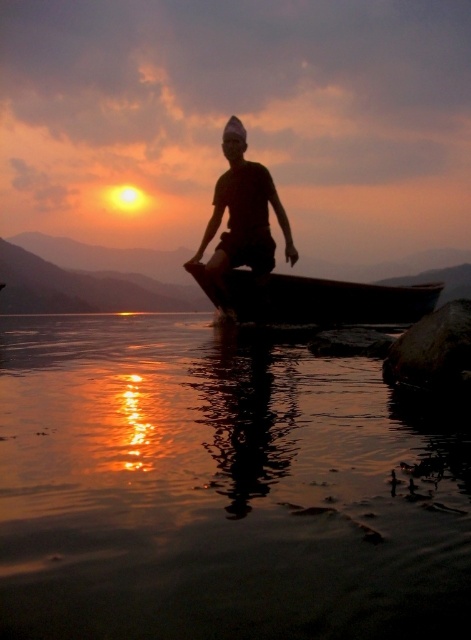
Is wooden canoe at center below matte black shirt at center?

Yes.

Does wooden canoe at center have a lesser width compared to matte black shirt at center?

Yes.

Who is more distant from viewer, (376, 298) or (268, 177)?

The point (376, 298) is more distant.

What are the coordinates of `wooden canoe at center` in the screenshot? It's located at (316, 298).

Can you confirm if transparent water at center is positioned above wooden canoe at center?

No, transparent water at center is not above wooden canoe at center.

The image size is (471, 640). I want to click on transparent water at center, so click(219, 490).

Measure the distance between transparent water at center and camera.

4.42 feet

I want to click on transparent water at center, so click(x=219, y=490).

Between transparent water at center and matte black shirt at center, which one is positioned lower?

transparent water at center is below.

Consider the image. Is the position of transparent water at center less distant than that of matte black shirt at center?

That is True.

At what (x,y) coordinates should I click in order to perform the action: click on transparent water at center. Please return your answer as a coordinate pair (x, y). Looking at the image, I should click on (219, 490).